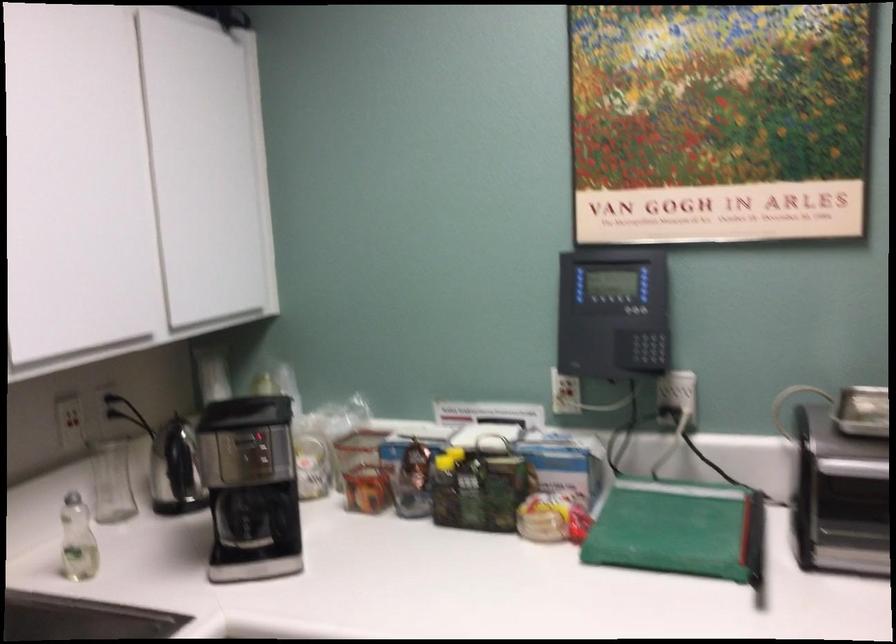
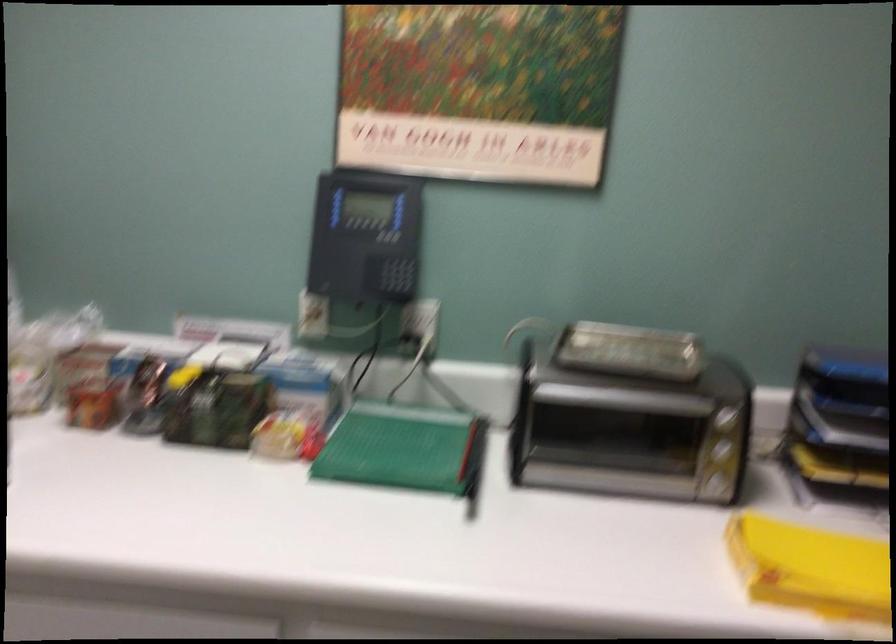
Question: The camera is either moving clockwise (left) or counter-clockwise (right) around the object. The first image is from the beginning of the video and the second image is from the end. Is the camera moving left or right when shooting the video?

Choices:
 (A) Left
 (B) Right

Answer: (A)